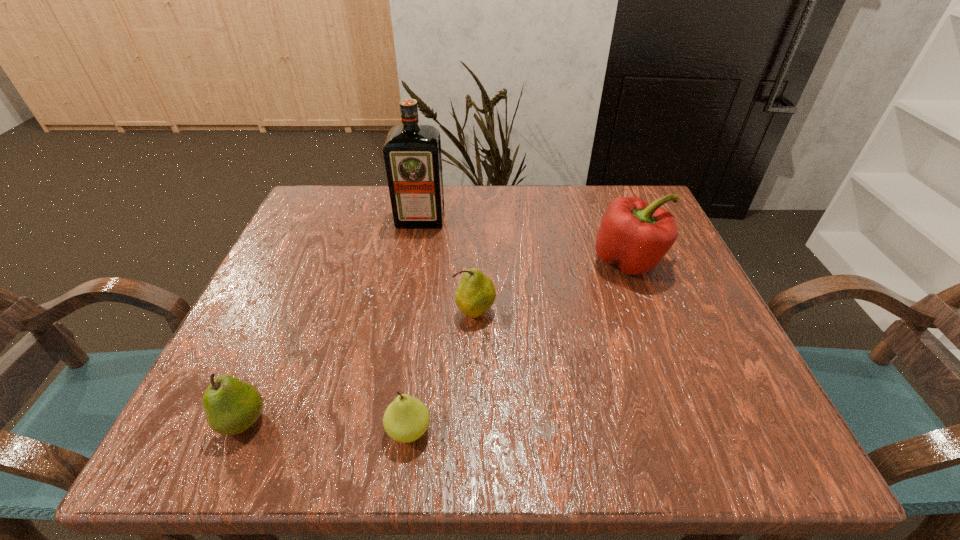
Find the location of `vacant space located on the back of the third nearest object`. vacant space located on the back of the third nearest object is located at coordinates (476, 274).

Image resolution: width=960 pixels, height=540 pixels. I want to click on vacant region located 0.390m on the right of the leftmost pear, so click(x=527, y=421).

Image resolution: width=960 pixels, height=540 pixels. Find the location of `vacant space situated 0.190m on the right of the second pear from right to left`. vacant space situated 0.190m on the right of the second pear from right to left is located at coordinates (560, 430).

Image resolution: width=960 pixels, height=540 pixels. Identify the location of liquor that is at the far edge. (412, 153).

Where is `bell pepper that is at the far edge`? The height and width of the screenshot is (540, 960). bell pepper that is at the far edge is located at coordinates (634, 235).

At what (x,y) coordinates should I click in order to perform the action: click on object that is at the left edge. Please return your answer as a coordinate pair (x, y). The height and width of the screenshot is (540, 960). Looking at the image, I should click on (231, 406).

Find the location of a particular element. This screenshot has height=540, width=960. object that is positioned at the right edge is located at coordinates (634, 235).

Where is `object located in the near left corner section of the desktop`? The width and height of the screenshot is (960, 540). object located in the near left corner section of the desktop is located at coordinates (231, 406).

Where is `object situated at the far right corner`? The width and height of the screenshot is (960, 540). object situated at the far right corner is located at coordinates (634, 235).

The image size is (960, 540). Find the location of `vacant point at the far edge`. vacant point at the far edge is located at coordinates (464, 227).